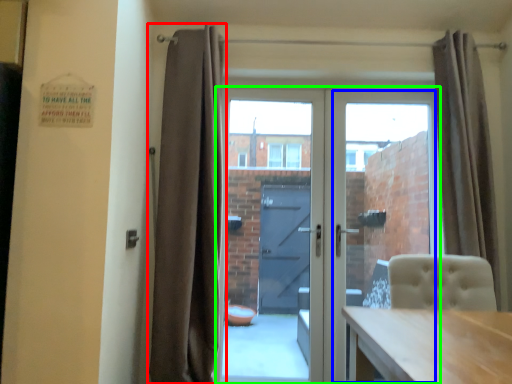
Question: Estimate the real-world distances between objects in this image. Which object is farther from curtain (highlighted by a red box), glass door (highlighted by a blue box) or door (highlighted by a green box)?

Choices:
 (A) glass door
 (B) door

Answer: (A)